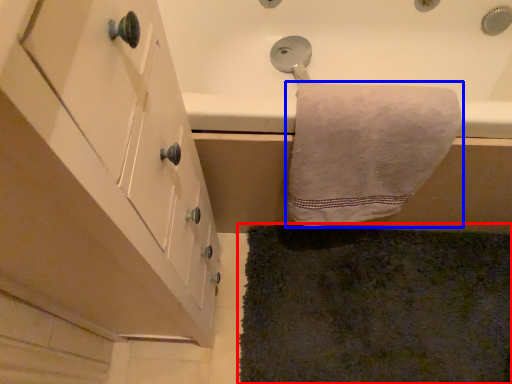
Question: Which object is further to the camera taking this photo, bath mat (highlighted by a red box) or towel (highlighted by a blue box)?

Choices:
 (A) bath mat
 (B) towel

Answer: (A)